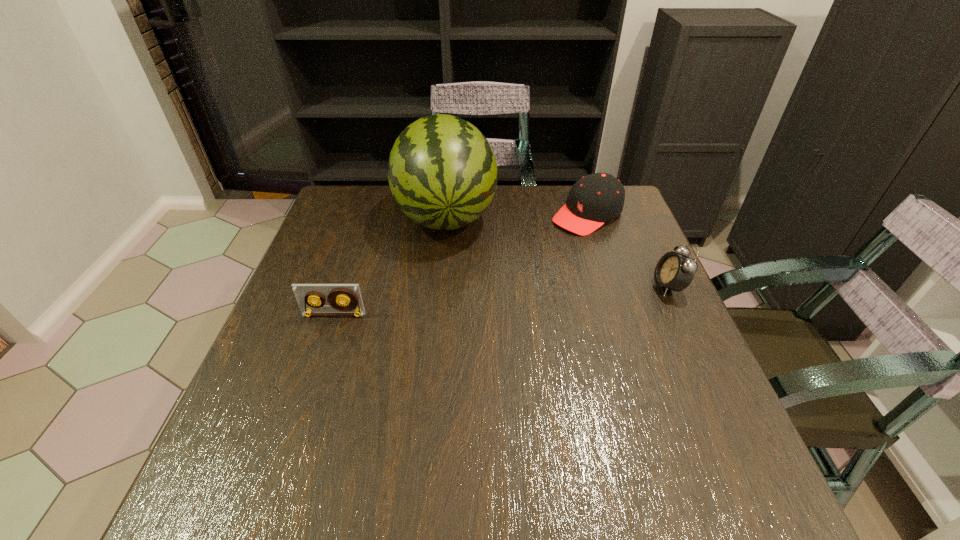
Where is `free space located on the front-facing side of the cap`? free space located on the front-facing side of the cap is located at coordinates (552, 239).

Find the location of a particular element. The width and height of the screenshot is (960, 540). vacant space located on the front-facing side of the cap is located at coordinates (513, 266).

Locate an element on the screen. Image resolution: width=960 pixels, height=540 pixels. vacant area situated on the front-facing side of the cap is located at coordinates (520, 260).

Where is `vacant area situated 0.340m at the stem end of the tallest object`? vacant area situated 0.340m at the stem end of the tallest object is located at coordinates (463, 355).

Locate an element on the screen. vacant space situated at the stem end of the tallest object is located at coordinates (466, 375).

Where is `vacant space located 0.080m at the stem end of the tallest object`? vacant space located 0.080m at the stem end of the tallest object is located at coordinates (452, 273).

You are a GUI agent. You are given a task and a screenshot of the screen. Output one action in this format:
    pyautogui.click(x=<x>, y=<y>)
    Task: Click on the cap that is at the far edge
    
    Given the screenshot: What is the action you would take?
    pyautogui.click(x=597, y=198)

Locate an element on the screen. watermelon that is at the far edge is located at coordinates (442, 172).

I want to click on object that is at the left edge, so click(x=305, y=293).

Where is `alarm clock at the right edge`? alarm clock at the right edge is located at coordinates (674, 271).